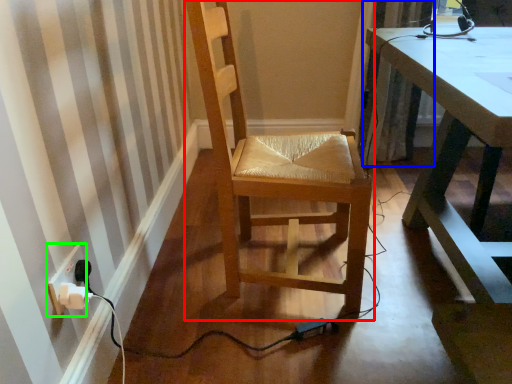
Question: Considering the real-world distances, which object is closest to chair (highlighted by a red box)? curtain (highlighted by a blue box) or electric outlet (highlighted by a green box).

Choices:
 (A) curtain
 (B) electric outlet

Answer: (B)